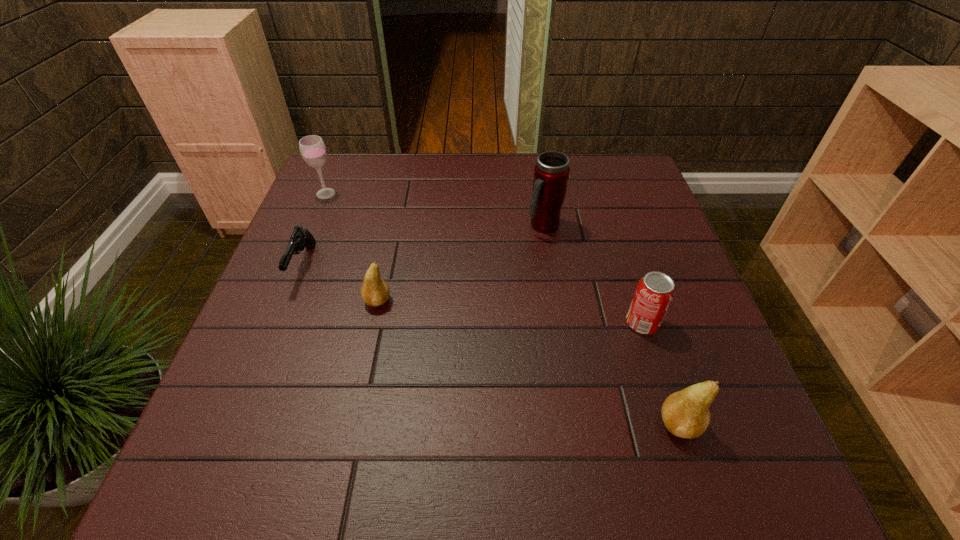
At what (x,y) coordinates should I click in order to perform the action: click on the shorter pear. Please return your answer as a coordinate pair (x, y). Looking at the image, I should click on (375, 291).

You are a GUI agent. You are given a task and a screenshot of the screen. Output one action in this format:
    pyautogui.click(x=<x>, y=<y>)
    Task: Click on the third object from left to right
    This screenshot has height=540, width=960.
    Given the screenshot: What is the action you would take?
    pyautogui.click(x=375, y=291)

You are a GUI agent. You are given a task and a screenshot of the screen. Output one action in this format:
    pyautogui.click(x=<x>, y=<y>)
    Task: Click on the nearer pear
    Image resolution: width=960 pixels, height=540 pixels.
    Given the screenshot: What is the action you would take?
    pyautogui.click(x=686, y=414)

Locate an element on the screen. This screenshot has width=960, height=540. the nearest object is located at coordinates (686, 414).

I want to click on thermos bottle, so (551, 173).

Where is `the second farthest object`? This screenshot has width=960, height=540. the second farthest object is located at coordinates (551, 173).

Find the location of a particular element. The width and height of the screenshot is (960, 540). the fifth shortest object is located at coordinates (312, 148).

At what (x,y) coordinates should I click in order to perform the action: click on the farthest object. Please return your answer as a coordinate pair (x, y). Looking at the image, I should click on (312, 148).

Locate an element on the screen. soda can is located at coordinates (655, 291).

This screenshot has height=540, width=960. Identify the location of the shortest object. (301, 238).